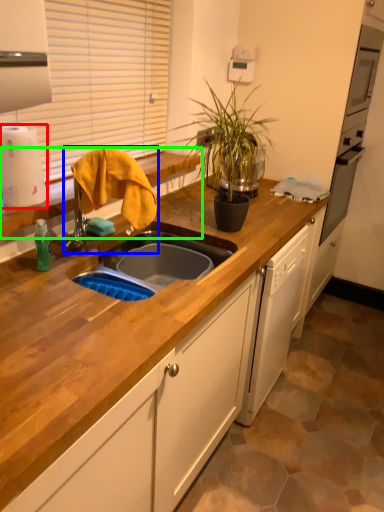
Question: Considering the real-world distances, which object is farthest from paper towel (highlighted by a red box)? faucet (highlighted by a blue box) or countertop (highlighted by a green box)?

Choices:
 (A) faucet
 (B) countertop

Answer: (B)